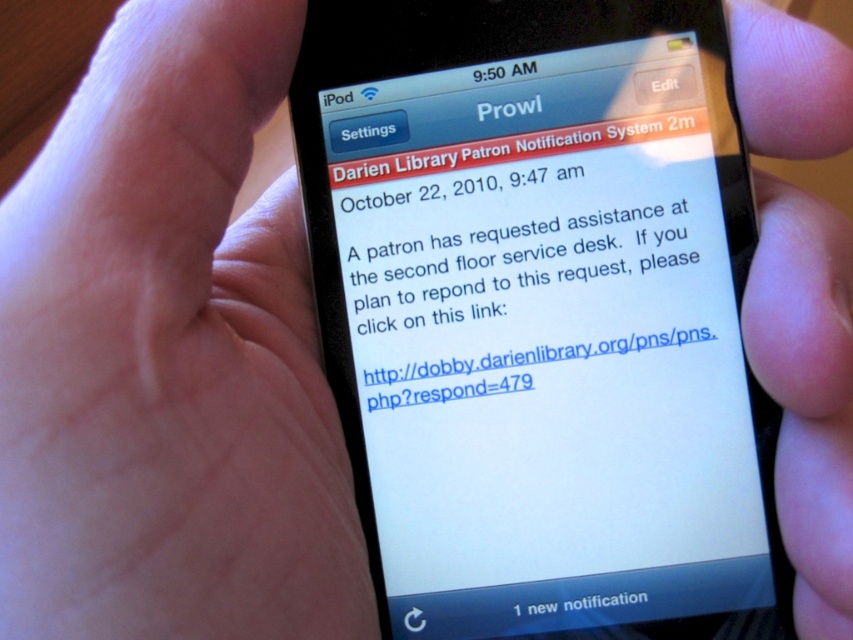
You are a library assistant who just received a notification on your phone. You see two points on the screen, point A at point (338, 236) and point B at point (630, 600). Which point is closer to the bottom edge of the phone screen?

Point B at point (630, 600) is closer to the bottom edge of the phone screen because it is behind point A at point (338, 236).

What is the exact location of the white paper text at center on the phone screen?

The white paper text at center is located at point (535,284) on the phone screen.